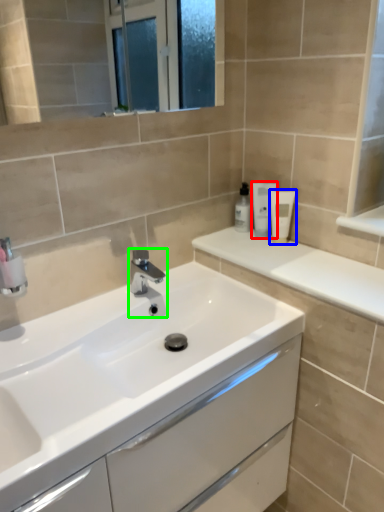
Question: Which object is positioned farthest from toiletry (highlighted by a red box)? Select from toiletry (highlighted by a blue box) and tap (highlighted by a green box).

Choices:
 (A) toiletry
 (B) tap

Answer: (B)